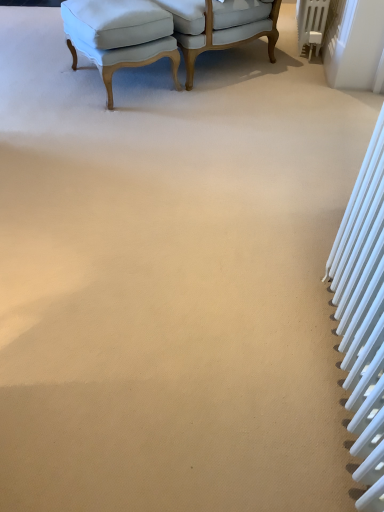
Question: Can you confirm if light blue fabric chair at upper center, the second chair from the left, is wider than light blue fabric ottoman at upper left, acting as the second chair starting from the right?

Choices:
 (A) yes
 (B) no

Answer: (A)

Question: Can you confirm if light blue fabric chair at upper center, the second chair from the left, is taller than light blue fabric ottoman at upper left, the 1th chair positioned from the left?

Choices:
 (A) yes
 (B) no

Answer: (A)

Question: Is light blue fabric chair at upper center, which is counted as the 1th chair, starting from the right, oriented towards light blue fabric ottoman at upper left, the 1th chair positioned from the left?

Choices:
 (A) yes
 (B) no

Answer: (A)

Question: From the image's perspective, is light blue fabric chair at upper center, which is counted as the 1th chair, starting from the right, over light blue fabric ottoman at upper left, the 1th chair positioned from the left?

Choices:
 (A) no
 (B) yes

Answer: (B)

Question: Considering the relative positions of light blue fabric chair at upper center, the second chair from the left, and light blue fabric ottoman at upper left, acting as the second chair starting from the right, in the image provided, is light blue fabric chair at upper center, the second chair from the left, to the right of light blue fabric ottoman at upper left, acting as the second chair starting from the right, from the viewer's perspective?

Choices:
 (A) no
 (B) yes

Answer: (B)

Question: Does light blue fabric chair at upper center, which is counted as the 1th chair, starting from the right, lie behind light blue fabric ottoman at upper left, the 1th chair positioned from the left?

Choices:
 (A) no
 (B) yes

Answer: (B)

Question: Is white metallic radiator at upper right, the first radiator from the back, touching white metallic radiator at right, the 2th radiator viewed from the top?

Choices:
 (A) no
 (B) yes

Answer: (A)

Question: Is the depth of white metallic radiator at upper right, which appears as the 1th radiator when viewed from the right, greater than that of white metallic radiator at right, the 1th radiator from the front?

Choices:
 (A) no
 (B) yes

Answer: (B)

Question: From a real-world perspective, is white metallic radiator at upper right, marked as the 1th radiator in a top-to-bottom arrangement, over white metallic radiator at right, positioned as the first radiator in left-to-right order?

Choices:
 (A) no
 (B) yes

Answer: (A)

Question: Does white metallic radiator at upper right, arranged as the second radiator when viewed from the front, have a lesser width compared to white metallic radiator at right, the 2th radiator viewed from the top?

Choices:
 (A) no
 (B) yes

Answer: (B)

Question: Considering the relative sizes of white metallic radiator at upper right, which appears as the 1th radiator when viewed from the right, and white metallic radiator at right, positioned as the 2th radiator in right-to-left order, in the image provided, is white metallic radiator at upper right, which appears as the 1th radiator when viewed from the right, shorter than white metallic radiator at right, positioned as the 2th radiator in right-to-left order,?

Choices:
 (A) no
 (B) yes

Answer: (B)

Question: Does white metallic radiator at upper right, which appears as the second radiator when viewed from the left, have a greater height compared to white metallic radiator at right, the first radiator from the bottom?

Choices:
 (A) no
 (B) yes

Answer: (A)

Question: From a real-world perspective, is white metallic radiator at upper right, the 2th radiator in the bottom-to-top sequence, below light blue fabric chair at upper center, which is counted as the 1th chair, starting from the right?

Choices:
 (A) no
 (B) yes

Answer: (B)